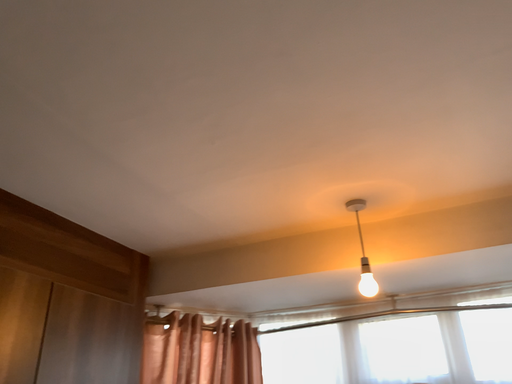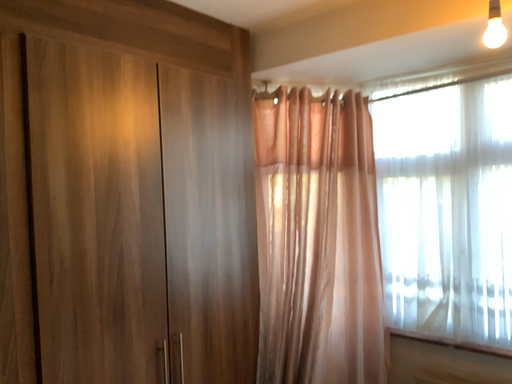
Question: How did the camera likely rotate when shooting the video?

Choices:
 (A) rotated left
 (B) rotated right

Answer: (A)